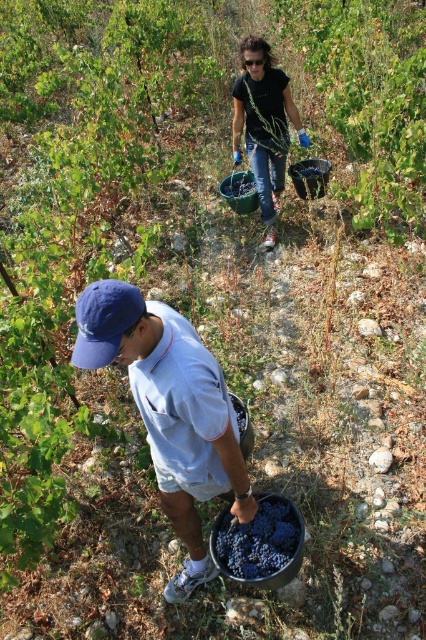
You are standing at the point labeled as point (169, 410) in the image. What object is located at this point?

The point (169, 410) corresponds to the blue fabric cap at lower left.

You are standing at the entrance of the vineyard and see the blue fabric cap at lower left and the dark purple grapes at lower center. Which object is located higher in the image?

The blue fabric cap at lower left is above dark purple grapes at lower center, so the blue fabric cap at lower left is higher in the image.